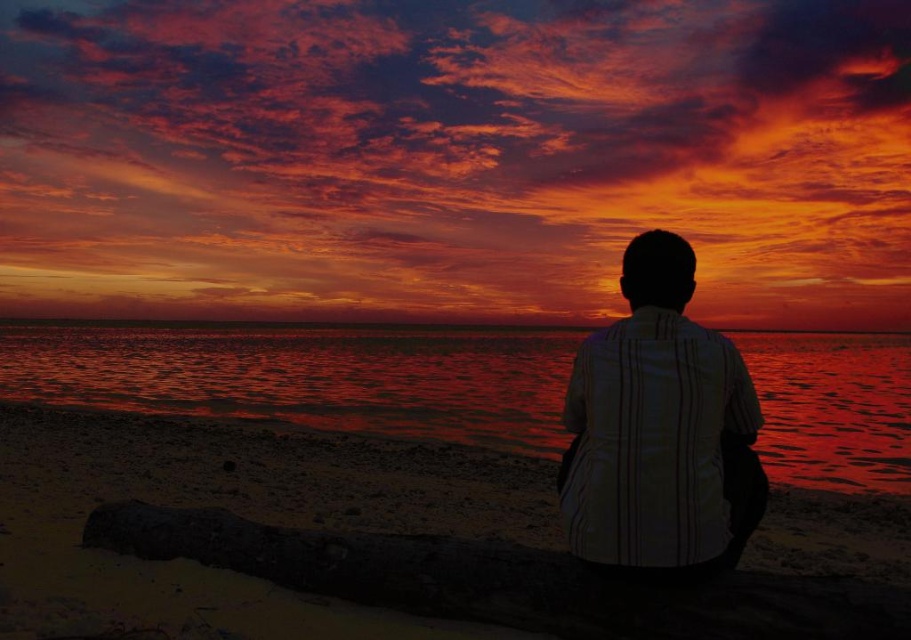
You are a photographer trying to capture the sunset. You have two subjects in your viewfinder, the smooth sand beach at lower center and the smooth water at center. Which subject is closer to the horizon?

The smooth water at center is closer to the horizon because it is taller than the smooth sand beach at lower center.

You are a photographer trying to capture the sunset. You notice the smooth water at center and the white striped shirt at center in your frame. Which object occupies more horizontal space in the photo?

The smooth water at center occupies more horizontal space in the photo because its width is larger than that of the white striped shirt at center.

You are standing on the beach and see the smooth water at center and the white striped shirt at center. Which object is closer to the horizon?

The smooth water at center is closer to the horizon because it is positioned below the white striped shirt at center, which places it farther away from the observer.